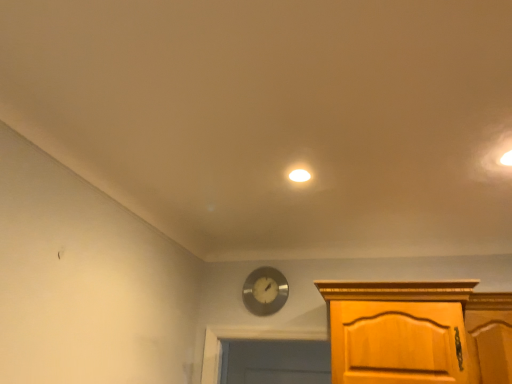
Describe the element at coordinates (265, 291) in the screenshot. I see `metallic silver clock at center` at that location.

Where is `metallic silver clock at center`? This screenshot has height=384, width=512. metallic silver clock at center is located at coordinates (265, 291).

What do you see at coordinates (298, 175) in the screenshot?
I see `white matte light fixture at center` at bounding box center [298, 175].

This screenshot has height=384, width=512. In order to click on white matte light fixture at center in this screenshot , I will do `click(298, 175)`.

This screenshot has height=384, width=512. What are the coordinates of `metallic silver clock at center` in the screenshot? It's located at (265, 291).

Considering the positions of objects white matte light fixture at center and metallic silver clock at center in the image provided, who is more to the left, white matte light fixture at center or metallic silver clock at center?

metallic silver clock at center is more to the left.

In the image, is white matte light fixture at center positioned in front of or behind metallic silver clock at center?

In the image, white matte light fixture at center appears in front of metallic silver clock at center.

Does point (297, 180) come in front of point (274, 300)?

Yes, point (297, 180) is in front of point (274, 300).

In the scene shown: From the image's perspective, relative to metallic silver clock at center, is white matte light fixture at center above or below?

Clearly, from the image's perspective, white matte light fixture at center is above metallic silver clock at center.

From a real-world perspective, is white matte light fixture at center positioned over metallic silver clock at center based on gravity?

Indeed, from a real-world perspective, white matte light fixture at center stands above metallic silver clock at center.

Is white matte light fixture at center wider or thinner than metallic silver clock at center?

white matte light fixture at center is wider than metallic silver clock at center.

Considering the sizes of objects white matte light fixture at center and metallic silver clock at center in the image provided, who is taller, white matte light fixture at center or metallic silver clock at center?

Standing taller between the two is metallic silver clock at center.

Based on the photo, based on their sizes in the image, would you say white matte light fixture at center is bigger or smaller than metallic silver clock at center?

Considering their sizes, white matte light fixture at center takes up less space than metallic silver clock at center.

Would you say white matte light fixture at center is outside metallic silver clock at center?

Indeed, white matte light fixture at center is completely outside metallic silver clock at center.

Would you say white matte light fixture at center is a long distance from metallic silver clock at center?

white matte light fixture at center is far away from metallic silver clock at center.

Is white matte light fixture at center positioned with its back to metallic silver clock at center?

white matte light fixture at center is not turned away from metallic silver clock at center.

In the scene shown: Can you tell me how much white matte light fixture at center and metallic silver clock at center differ in facing direction?

The facing directions of white matte light fixture at center and metallic silver clock at center are 90 degrees apart.

This screenshot has height=384, width=512. Find the location of `lighting above the metallic silver clock at center (from the image's perspective)`. lighting above the metallic silver clock at center (from the image's perspective) is located at coordinates (298, 175).

Can you confirm if metallic silver clock at center is positioned to the right of white matte light fixture at center?

Incorrect, metallic silver clock at center is not on the right side of white matte light fixture at center.

Is the depth of metallic silver clock at center greater than that of white matte light fixture at center?

Yes.

Considering the positions of points (250, 298) and (291, 172), is point (250, 298) closer to camera compared to point (291, 172)?

No.

From the image's perspective, is metallic silver clock at center above white matte light fixture at center?

Incorrect, from the image's perspective, metallic silver clock at center is lower than white matte light fixture at center.

From a real-world perspective, is metallic silver clock at center physically below white matte light fixture at center?

Yes.

Does metallic silver clock at center have a greater width compared to white matte light fixture at center?

Incorrect, the width of metallic silver clock at center does not surpass that of white matte light fixture at center.

Consider the image. Which of these two, metallic silver clock at center or white matte light fixture at center, stands taller?

metallic silver clock at center.

Considering the sizes of objects metallic silver clock at center and white matte light fixture at center in the image provided, who is smaller, metallic silver clock at center or white matte light fixture at center?

white matte light fixture at center is smaller.

Which is correct: metallic silver clock at center is inside white matte light fixture at center, or outside of it?

metallic silver clock at center is spatially situated outside white matte light fixture at center.

Is the surface of metallic silver clock at center in direct contact with white matte light fixture at center?

No, metallic silver clock at center is not making contact with white matte light fixture at center.

Is metallic silver clock at center oriented towards white matte light fixture at center?

Yes, metallic silver clock at center is aimed at white matte light fixture at center.

What's the angular difference between metallic silver clock at center and white matte light fixture at center's facing directions?

The angle between the facing direction of metallic silver clock at center and the facing direction of white matte light fixture at center is 90 degrees.

How far apart are metallic silver clock at center and white matte light fixture at center?

The distance of metallic silver clock at center from white matte light fixture at center is 1.13 meters.

Find the location of a particular element. The image size is (512, 384). lighting above the metallic silver clock at center (from the image's perspective) is located at coordinates (298, 175).

Find the location of a particular element. lighting on the right of metallic silver clock at center is located at coordinates (298, 175).

Locate an element on the screen. wall clock below the white matte light fixture at center (from a real-world perspective) is located at coordinates (265, 291).